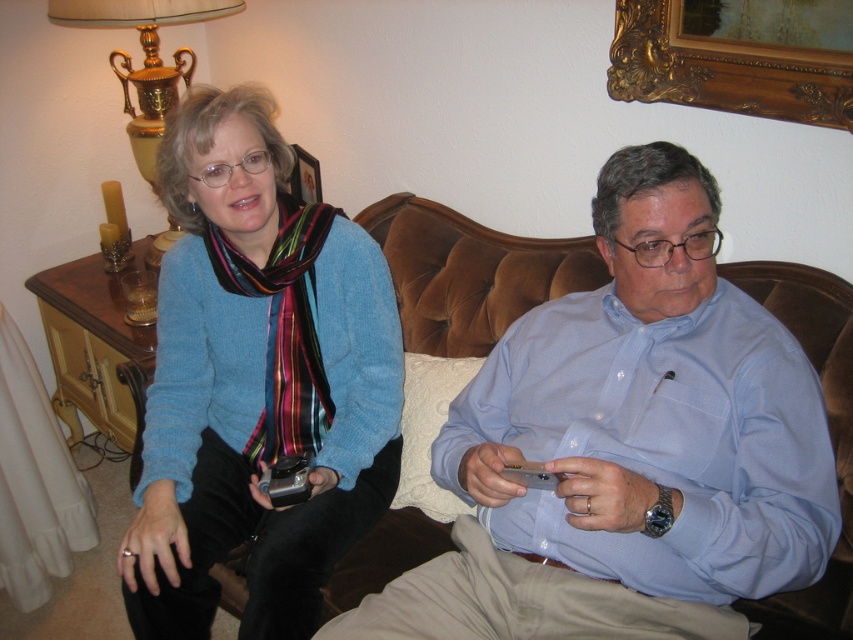
From the picture: Does gold ornate picture frame at upper center appear over wooden picture frame at upper center?

Correct, gold ornate picture frame at upper center is located above wooden picture frame at upper center.

Locate an element on the screen. gold ornate picture frame at upper center is located at coordinates (737, 56).

Based on the photo, who is more distant from viewer, (798, 93) or (309, 186)?

Point (309, 186)

The image size is (853, 640). In order to click on gold ornate picture frame at upper center in this screenshot , I will do `click(737, 56)`.

This screenshot has width=853, height=640. What do you see at coordinates (257, 381) in the screenshot? I see `matte blue sweater at left` at bounding box center [257, 381].

Is matte blue sweater at left above brown velvet couch at center?

Indeed, matte blue sweater at left is positioned over brown velvet couch at center.

This screenshot has height=640, width=853. I want to click on matte blue sweater at left, so click(x=257, y=381).

Can you confirm if gold ornate picture frame at upper center is bigger than gold metallic lamp at upper left?

Actually, gold ornate picture frame at upper center might be smaller than gold metallic lamp at upper left.

Does gold ornate picture frame at upper center have a smaller size compared to gold metallic lamp at upper left?

Correct, gold ornate picture frame at upper center occupies less space than gold metallic lamp at upper left.

What do you see at coordinates (737, 56) in the screenshot? I see `gold ornate picture frame at upper center` at bounding box center [737, 56].

You are a GUI agent. You are given a task and a screenshot of the screen. Output one action in this format:
    pyautogui.click(x=<x>, y=<y>)
    Task: Click on the gold ornate picture frame at upper center
    The height and width of the screenshot is (640, 853).
    Given the screenshot: What is the action you would take?
    pyautogui.click(x=737, y=56)